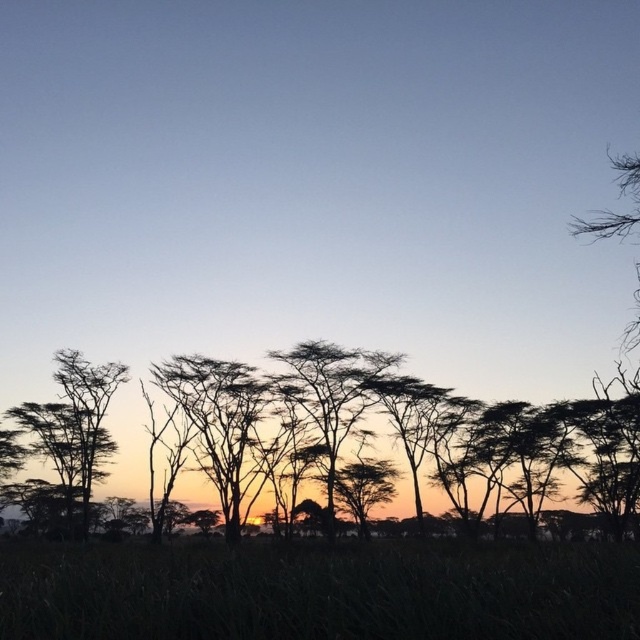
Which is below, green grass at lower center or silhouette tree at center?

silhouette tree at center is below.

Which is more to the left, green grass at lower center or silhouette tree at center?

silhouette tree at center is more to the left.

At what (x,y) coordinates should I click in order to perform the action: click on green grass at lower center. Please return your answer as a coordinate pair (x, y). The height and width of the screenshot is (640, 640). Looking at the image, I should click on (320, 593).

At what (x,y) coordinates should I click in order to perform the action: click on green grass at lower center. Please return your answer as a coordinate pair (x, y). The width and height of the screenshot is (640, 640). Looking at the image, I should click on (320, 593).